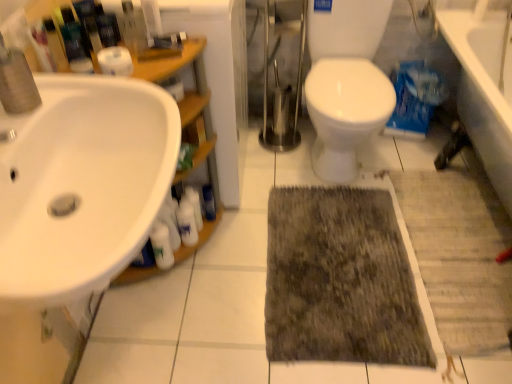
Image resolution: width=512 pixels, height=384 pixels. Find the location of `vacant space in front of white glossy bottle at lower left, which is the first cleaning product from left to right`. vacant space in front of white glossy bottle at lower left, which is the first cleaning product from left to right is located at coordinates (160, 310).